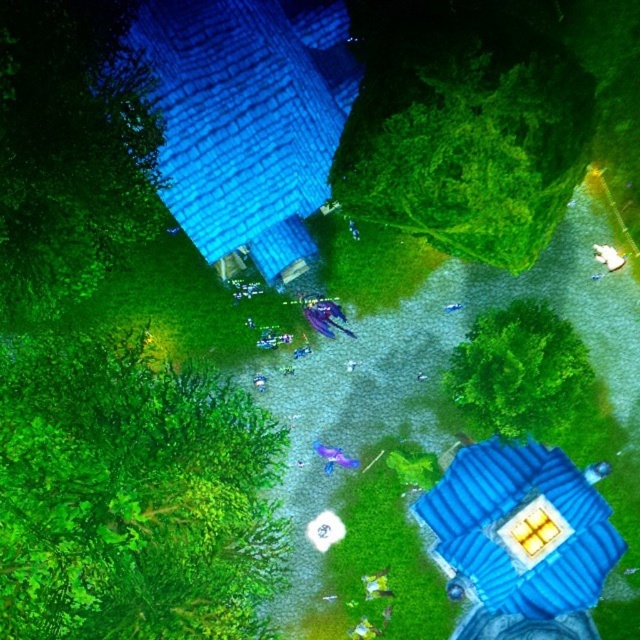
Question: Considering the relative positions of green leafy tree at upper center and green leafy tree at center in the image provided, where is green leafy tree at upper center located with respect to green leafy tree at center?

Choices:
 (A) above
 (B) below

Answer: (A)

Question: Which point is closer to the camera?

Choices:
 (A) green leafy tree at upper center
 (B) green leafy tree at center

Answer: (A)

Question: Can you confirm if green leafy tree at lower left is positioned to the right of green leafy tree at center?

Choices:
 (A) yes
 (B) no

Answer: (B)

Question: Which point is farther from the camera taking this photo?

Choices:
 (A) (188, 502)
 (B) (128, 134)
 (C) (528, 154)
 (D) (506, 396)

Answer: (B)

Question: Is green leafy tree at lower left bigger than green leafy tree at upper left?

Choices:
 (A) no
 (B) yes

Answer: (B)

Question: Among these points, which one is nearest to the camera?

Choices:
 (A) (86, 218)
 (B) (502, 371)

Answer: (B)